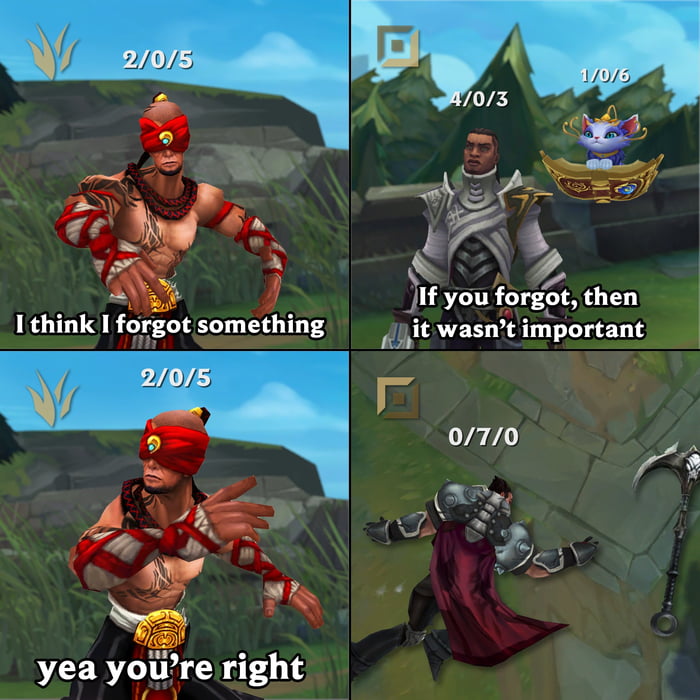
Find the location of a particular element. Image resolution: width=700 pixels, height=700 pixels. pictures is located at coordinates (260, 162), (414, 160), (314, 430), (626, 451).